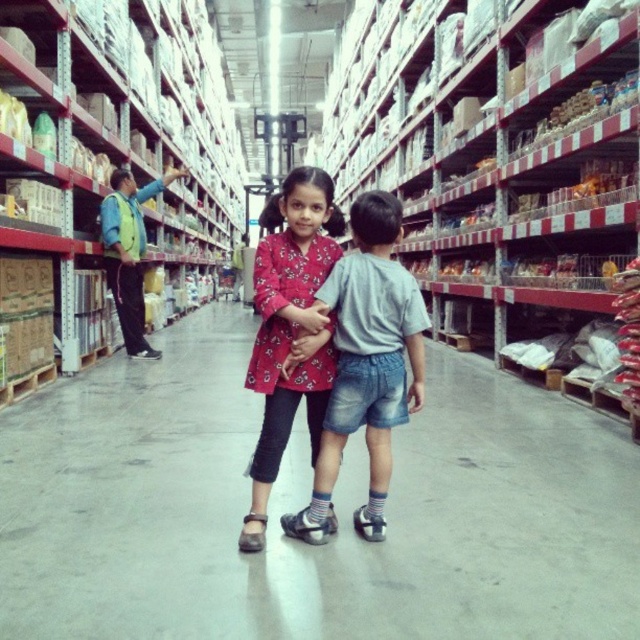
Can you confirm if metallic silver shelves at center is thinner than matte pink dress at center?

Correct, metallic silver shelves at center's width is less than matte pink dress at center's.

Which is behind, point (568, 64) or point (372, 524)?

The point (568, 64) is more distant.

Locate an element on the screen. metallic silver shelves at center is located at coordinates (508, 163).

Can you confirm if matte cardboard boxes at left is thinner than matte pink dress at center?

No, matte cardboard boxes at left is not thinner than matte pink dress at center.

Who is lower down, matte cardboard boxes at left or matte pink dress at center?

matte pink dress at center

Who is more distant from viewer, (12,209) or (397,314)?

Point (12,209)

Find the location of a particular element. matte cardboard boxes at left is located at coordinates (113, 147).

Who is lower down, metallic silver shelves at center or denim shorts at center?

Positioned lower is metallic silver shelves at center.

Between metallic silver shelves at center and denim shorts at center, which one has more height?

denim shorts at center is taller.

What are the coordinates of `metallic silver shelves at center` in the screenshot? It's located at (508, 163).

This screenshot has height=640, width=640. I want to click on metallic silver shelves at center, so click(508, 163).